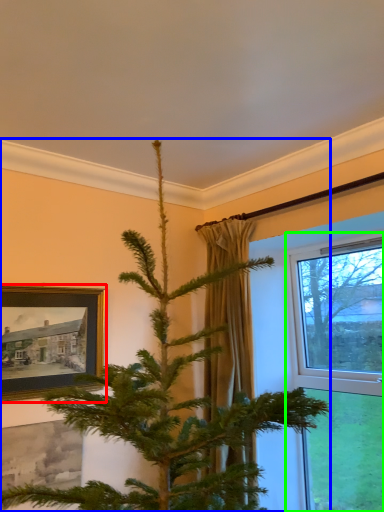
Question: Which object is the farthest from picture frame (highlighted by a red box)? Choose among these: christmas tree (highlighted by a blue box) or window (highlighted by a green box).

Choices:
 (A) christmas tree
 (B) window

Answer: (B)